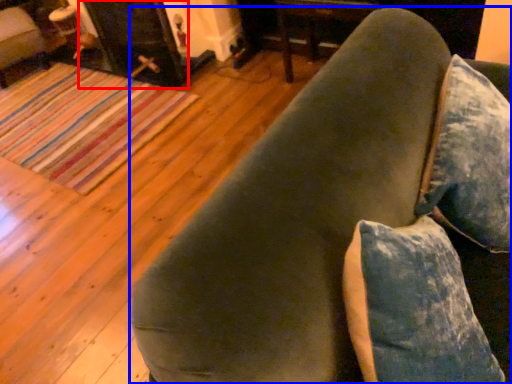
Question: Which of the following is the closest to the observer, fireplace (highlighted by a red box) or furniture (highlighted by a blue box)?

Choices:
 (A) fireplace
 (B) furniture

Answer: (B)